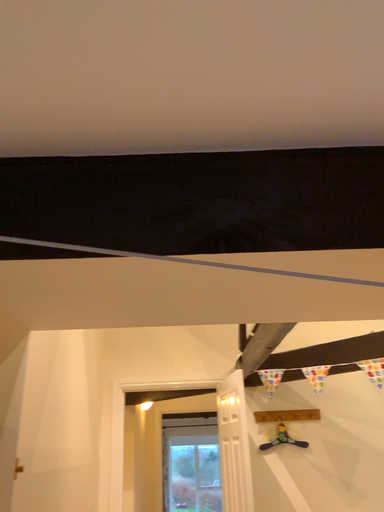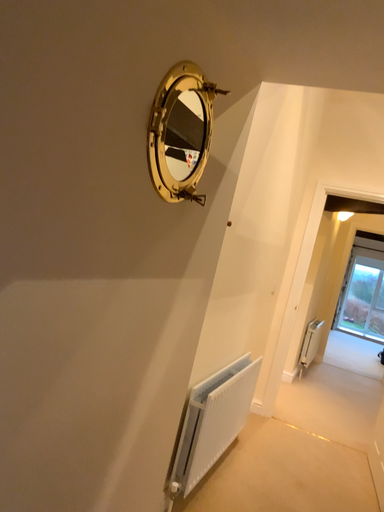
Question: Which way did the camera rotate in the video?

Choices:
 (A) rotated upward
 (B) rotated downward

Answer: (B)